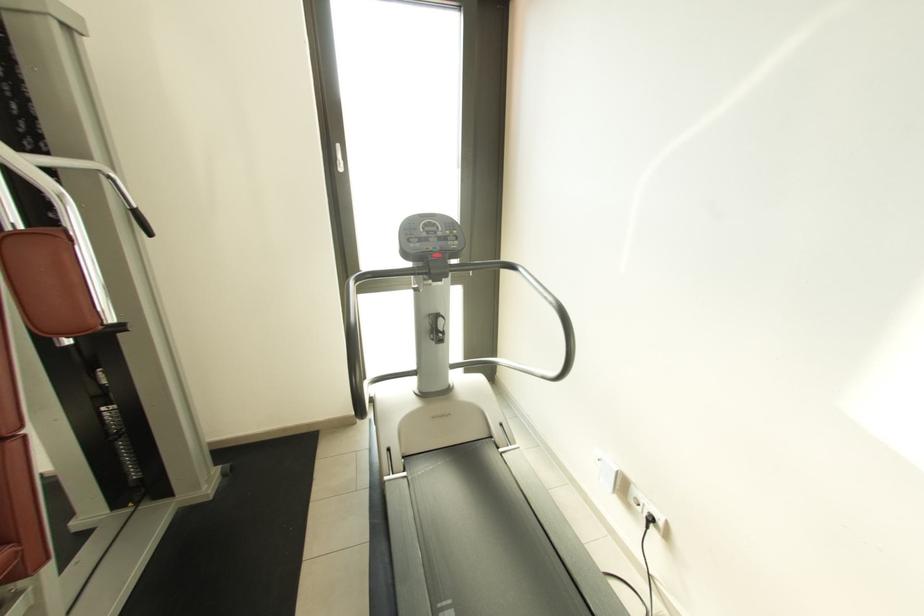
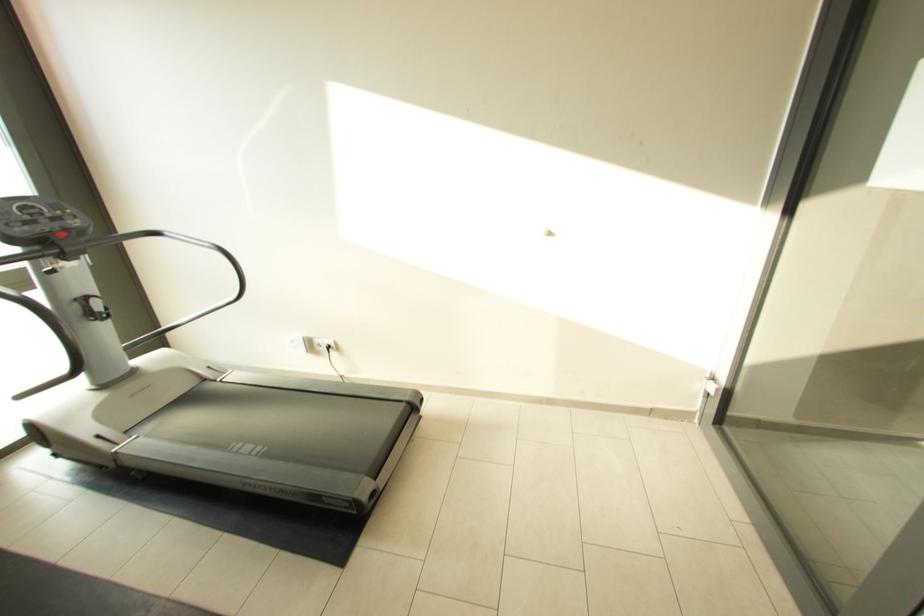
Find the pixel in the second image that matches [640,493] in the first image.

(322, 342)